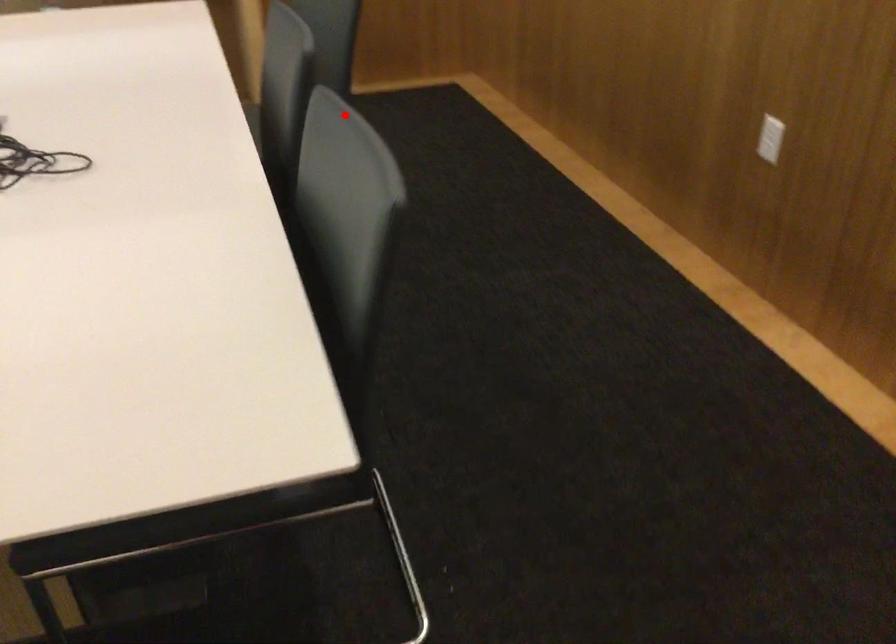
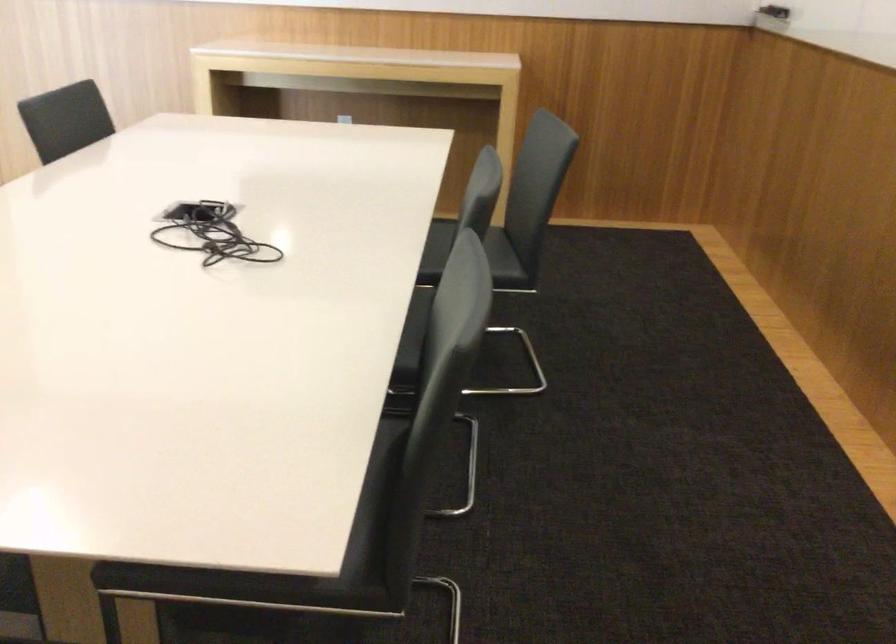
Locate, in the second image, the point that corresponds to the highlighted location in the first image.

(470, 256)